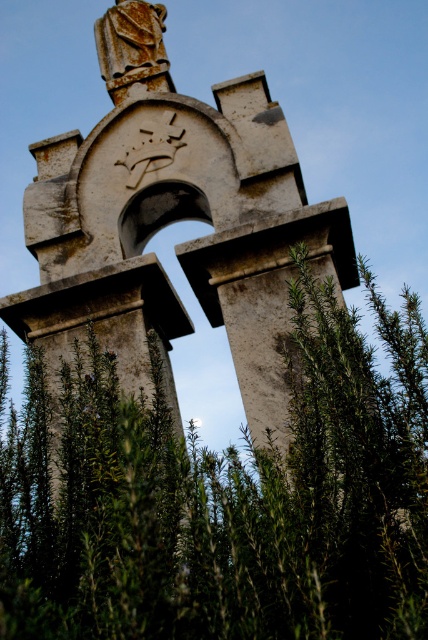
You are standing in front of the stone monument and see a point marked at coordinates (225, 497). What object is located at that point?

The point at coordinates (225, 497) corresponds to the green leafy plant at center.

You are a gardener who wants to water the green leafy plant at center. To reach it, you need to pass under the rusty stone arch at center. Is the arch wide enough for you to walk through comfortably?

The green leafy plant at center is positioned under the rusty stone arch at center, which suggests that the arch is wide enough to accommodate the plant and allow you to walk through comfortably.